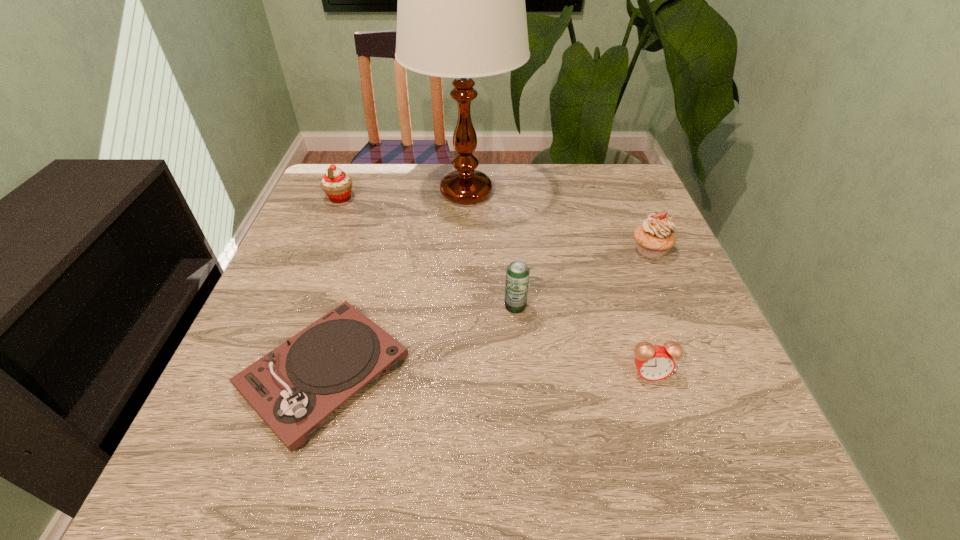
Where is `vacant area that satisfies the following two spatial constraints: 1. on the back side of the phonograph_record; 2. on the left side of the table lamp`? vacant area that satisfies the following two spatial constraints: 1. on the back side of the phonograph_record; 2. on the left side of the table lamp is located at coordinates (378, 192).

Locate an element on the screen. Image resolution: width=960 pixels, height=540 pixels. vacant space that satisfies the following two spatial constraints: 1. on the front side of the phonograph_record; 2. on the right side of the farther cupcake is located at coordinates (270, 373).